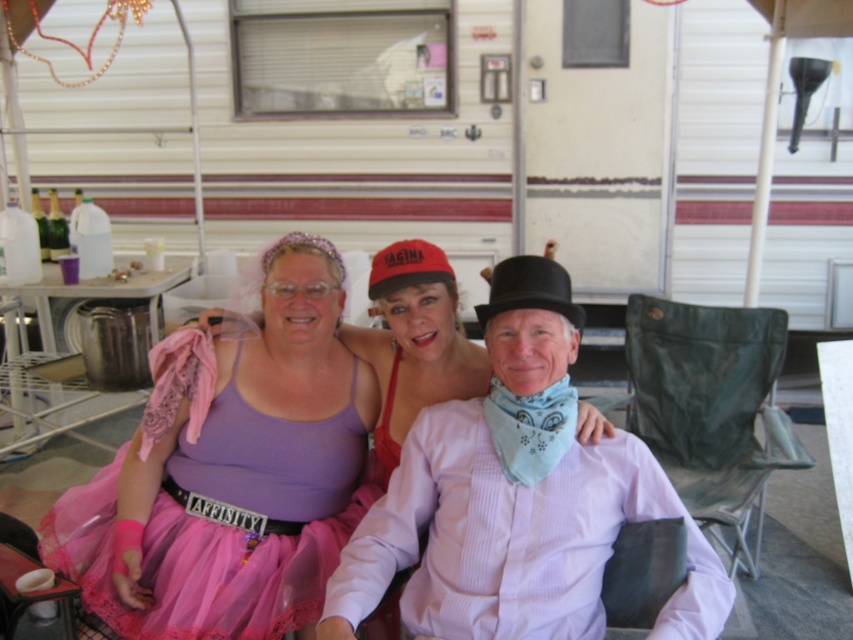
You are designing a stage for a play that needs to fit both the white plastic recreational vehicle at center and the pink tulle dress at center. Since the stage has limited space, which object should be placed first to ensure both fit properly?

The white plastic recreational vehicle at center should be placed first because its width is greater than the pink tulle dress at center, ensuring there is enough space for both.